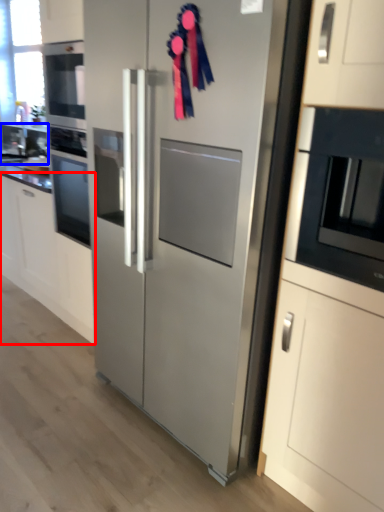
Question: Which of the following is the closest to the observer, cabinetry (highlighted by a red box) or sink (highlighted by a blue box)?

Choices:
 (A) cabinetry
 (B) sink

Answer: (A)